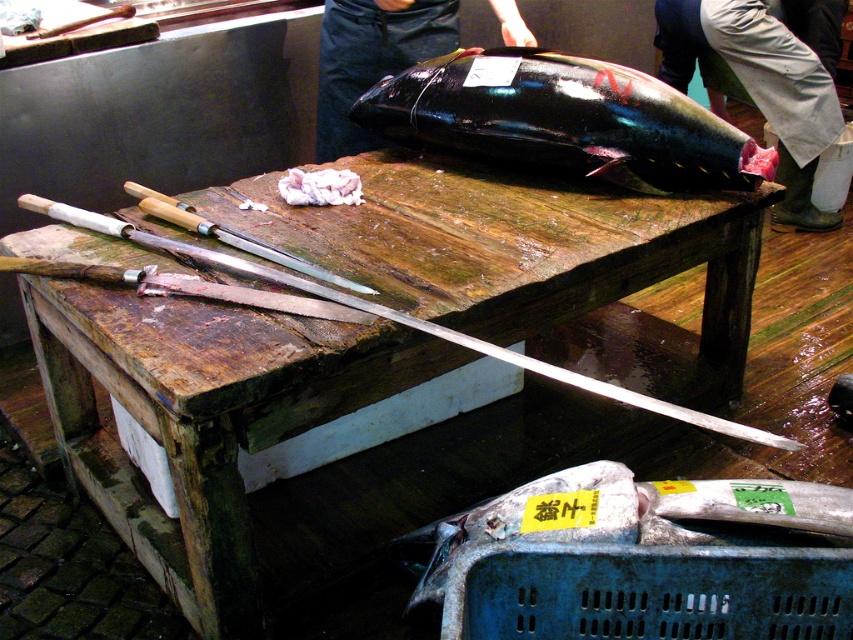
You are a chef preparing to cut a piece of fish. You have a wooden cutting board at center and a shiny metal knife at upper center. The minimum safe distance between the knife and the board to prevent slipping is 18 inches. Can you safely place the knife on the board?

The distance between the wooden cutting board at center and the shiny metal knife at upper center is 19.41 inches, which is greater than the minimum safe distance of 18 inches. Therefore, you can safely place the knife on the board.

You are a chef who needs to place a 15 cm long knife on the wooden cutting board at center. Considering the board is 30 cm in length, where should you place the knife to ensure it fits entirely on the board?

The wooden cutting board at center is positioned at point (202, 417). To ensure the 15 cm knife fits entirely on the board, place it along the length of the board, leaving at least 7.5 cm of space on both ends.

You are a chef preparing to fillet a fish. You have a shiny metal knife at upper center and see the glossy black fish at upper center on the table. Which object is taller?

The glossy black fish at upper center is taller than the shiny metal knife at upper center.